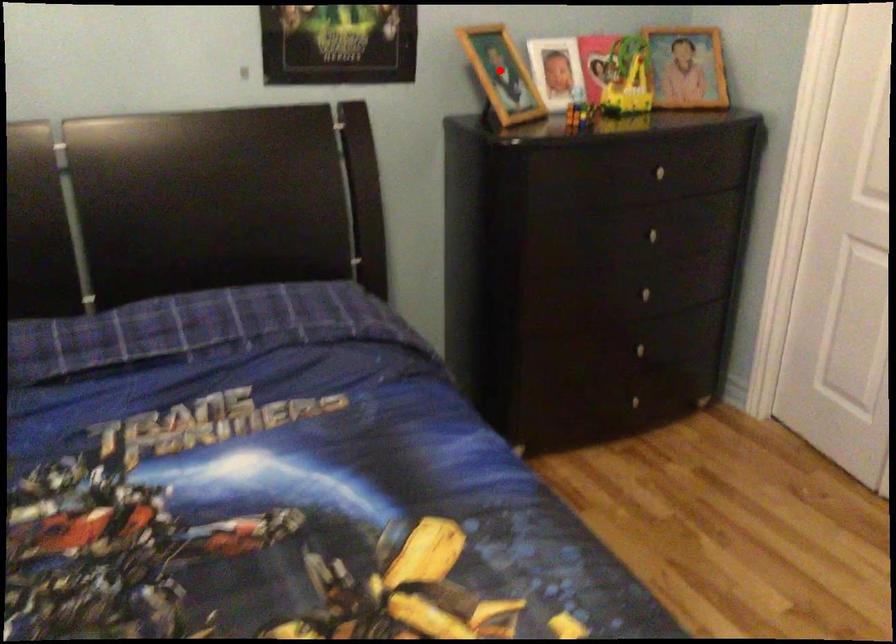
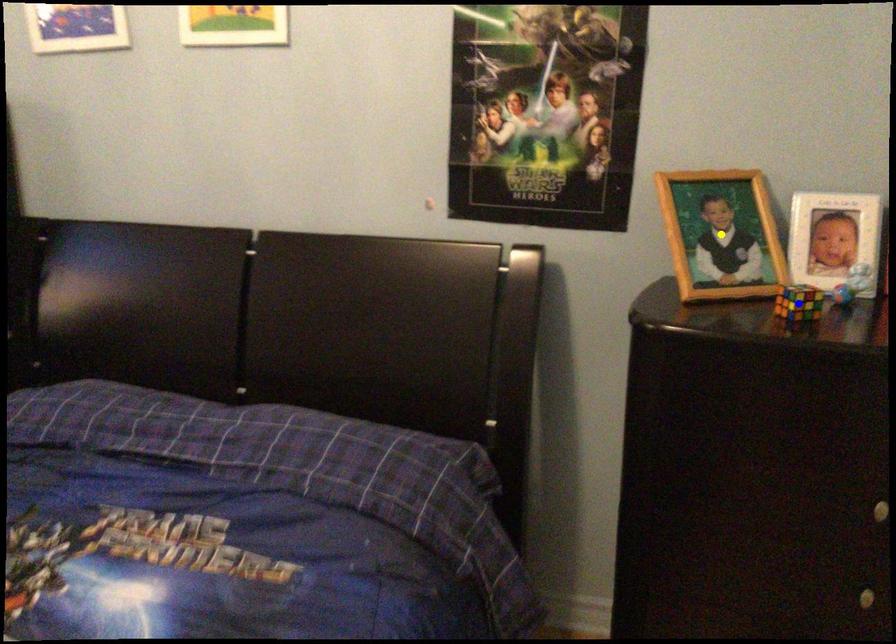
Question: I am providing you with two images of the same scene from different viewpoints. A red point is marked on the first image. You are given multiple points on the second image. Which point in image 2 is actually the same real-world point as the red point in image 1?

Choices:
 (A) blue point
 (B) green point
 (C) yellow point

Answer: (C)